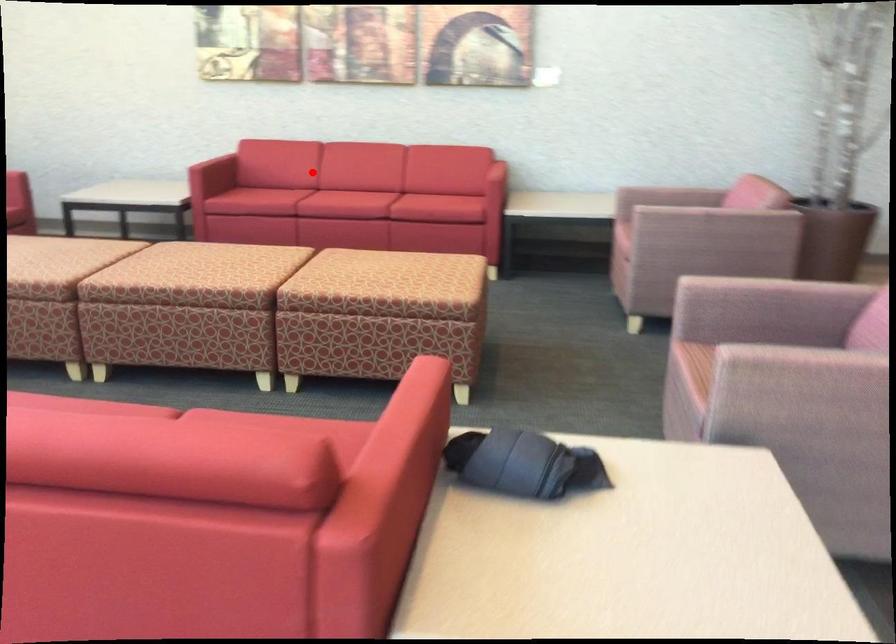
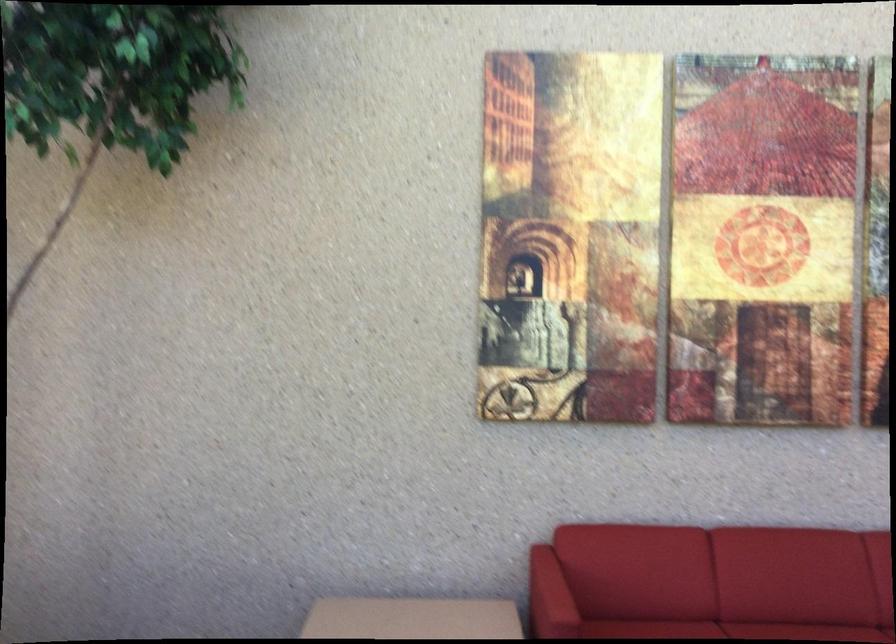
In the second image, find the point that corresponds to the highlighted location in the first image.

(727, 630)